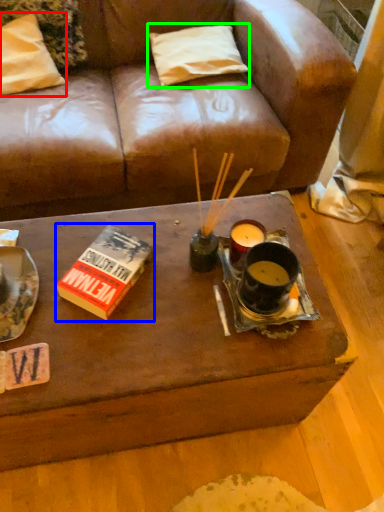
Question: Based on their relative distances, which object is farther from pillow (highlighted by a red box)? Choose from paperback book (highlighted by a blue box) and pillow (highlighted by a green box).

Choices:
 (A) paperback book
 (B) pillow

Answer: (A)